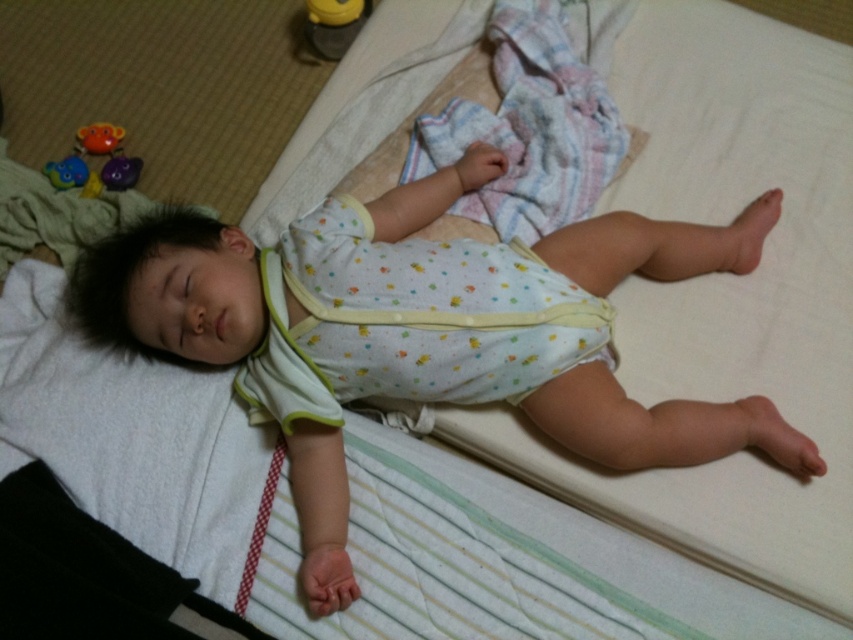
Question: Which point is closer to the camera?

Choices:
 (A) (71, 186)
 (B) (357, 337)

Answer: (B)

Question: Can you confirm if white dotted fabric diaper at center is positioned to the right of matte plastic toys at upper left?

Choices:
 (A) yes
 (B) no

Answer: (A)

Question: Can you confirm if white dotted fabric diaper at center is thinner than matte plastic toys at upper left?

Choices:
 (A) yes
 (B) no

Answer: (B)

Question: Can you confirm if white dotted fabric diaper at center is positioned to the right of matte plastic toys at upper left?

Choices:
 (A) yes
 (B) no

Answer: (A)